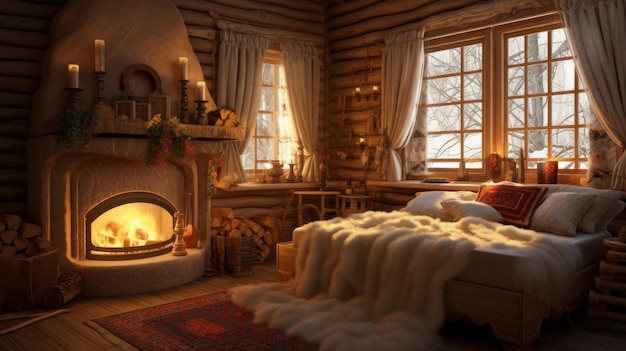
Find the location of a particular element. This screenshot has height=351, width=626. candles is located at coordinates (79, 77), (101, 54), (185, 65), (206, 83).